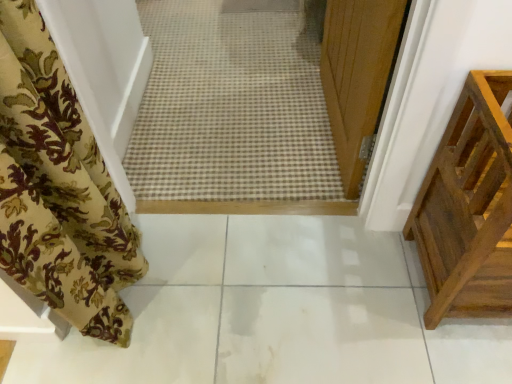
Question: From a real-world perspective, relative to white glossy tile at center, is floral fabric curtain at left vertically above or below?

Choices:
 (A) below
 (B) above

Answer: (B)

Question: Relative to white glossy tile at center, is floral fabric curtain at left in front or behind?

Choices:
 (A) front
 (B) behind

Answer: (A)

Question: Considering the real-world distances, which object is farthest from the floral fabric curtain at left?

Choices:
 (A) white glossy tile at center
 (B) brown wooden crate at right

Answer: (B)

Question: Which object is positioned farthest from the white glossy tile at center?

Choices:
 (A) brown wooden crate at right
 (B) floral fabric curtain at left

Answer: (B)